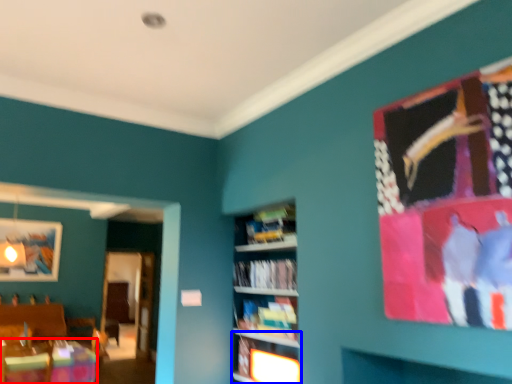
Question: Which of the following is the closest to the observer, table (highlighted by a red box) or shelf (highlighted by a blue box)?

Choices:
 (A) table
 (B) shelf

Answer: (B)